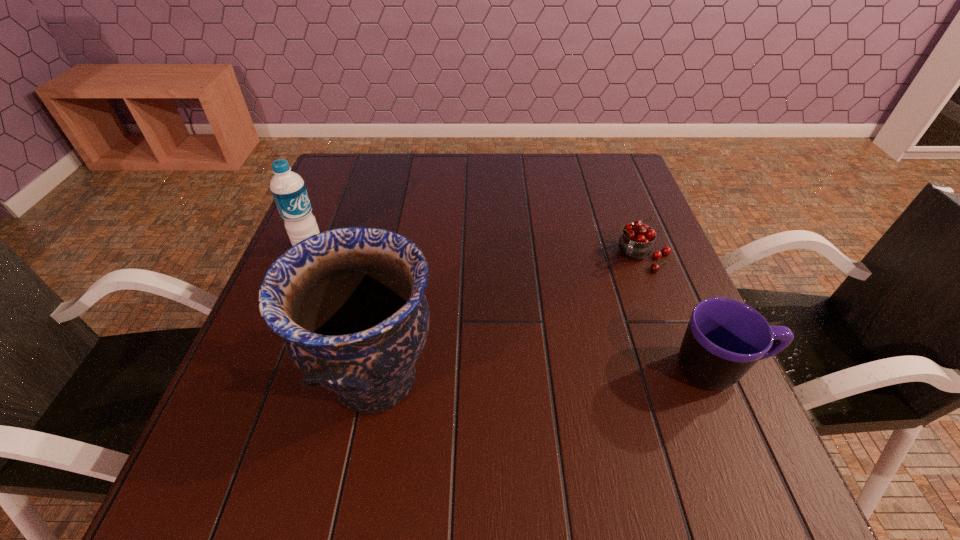
In order to click on vacant space at the near edge in this screenshot , I will do `click(525, 432)`.

The height and width of the screenshot is (540, 960). I want to click on vacant space at the left edge, so click(x=252, y=380).

At what (x,y) coordinates should I click in order to perform the action: click on vacant position at the right edge of the desktop. Please return your answer as a coordinate pair (x, y). The height and width of the screenshot is (540, 960). Looking at the image, I should click on (635, 282).

In the image, there is a desktop. Where is `vacant space at the far left corner`? The width and height of the screenshot is (960, 540). vacant space at the far left corner is located at coordinates (368, 172).

Locate an element on the screen. This screenshot has width=960, height=540. blank space at the far right corner of the desktop is located at coordinates (594, 156).

In order to click on vacant point located between the third object from right to left and the mug in this screenshot , I will do `click(547, 375)`.

Locate an element on the screen. This screenshot has height=540, width=960. vacant space that's between the pot filled with cherries and the leftmost object is located at coordinates (475, 252).

What are the coordinates of `free space between the mug and the water bottle` in the screenshot? It's located at (514, 309).

You are a GUI agent. You are given a task and a screenshot of the screen. Output one action in this format:
    pyautogui.click(x=<x>, y=<y>)
    Task: Click on the vacant area that lies between the pottery and the pot filled with cherries
    The image size is (960, 540).
    Given the screenshot: What is the action you would take?
    pyautogui.click(x=508, y=318)

At what (x,y) coordinates should I click in order to perform the action: click on free space between the water bottle and the mug. Please return your answer as a coordinate pair (x, y). Looking at the image, I should click on (514, 309).